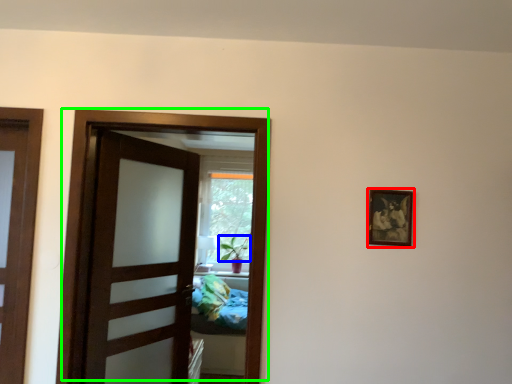
Question: Which object is positioned closest to picture frame (highlighted by a red box)? Select from plant (highlighted by a blue box) and door (highlighted by a green box).

Choices:
 (A) plant
 (B) door

Answer: (B)